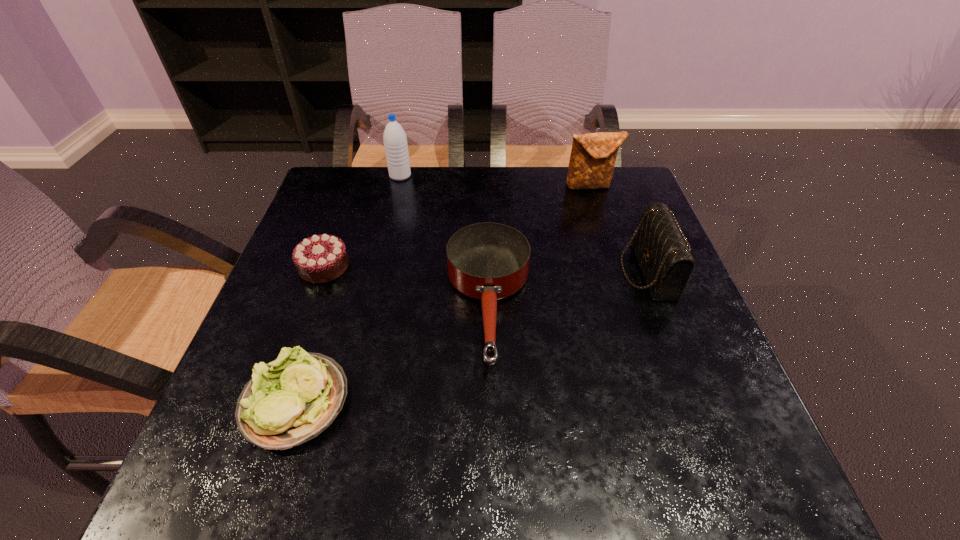
This screenshot has width=960, height=540. Find the location of `water bottle`. water bottle is located at coordinates (394, 137).

The width and height of the screenshot is (960, 540). Find the location of `the taller clutch bag`. the taller clutch bag is located at coordinates (593, 155).

Locate an element on the screen. The image size is (960, 540). the third tallest object is located at coordinates (659, 244).

This screenshot has width=960, height=540. Find the location of `the shorter clutch bag`. the shorter clutch bag is located at coordinates (659, 244).

Locate an element on the screen. the third object from right to left is located at coordinates (487, 261).

You are a GUI agent. You are given a task and a screenshot of the screen. Output one action in this format:
    pyautogui.click(x=<x>, y=<y>)
    Task: Click on the chocolate cake
    
    Given the screenshot: What is the action you would take?
    pyautogui.click(x=321, y=258)

Find the location of a particular element. This screenshot has width=960, height=540. lettuce is located at coordinates (293, 399).

The width and height of the screenshot is (960, 540). Find the location of `vacant space situated on the right of the water bottle`. vacant space situated on the right of the water bottle is located at coordinates (551, 176).

Where is `vacant region located on the open side of the farther clutch bag`? The width and height of the screenshot is (960, 540). vacant region located on the open side of the farther clutch bag is located at coordinates (619, 279).

You are a GUI agent. You are given a task and a screenshot of the screen. Output one action in this format:
    pyautogui.click(x=<x>, y=<y>)
    Task: Click on the free space located 0.370m on the front flap of the nearer clutch bag
    The width and height of the screenshot is (960, 540).
    Given the screenshot: What is the action you would take?
    pyautogui.click(x=457, y=271)